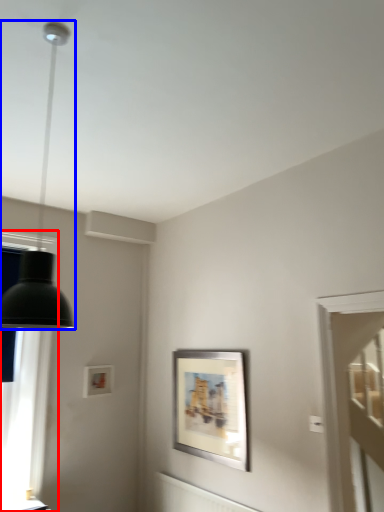
Question: Which object is further to the camera taking this photo, window (highlighted by a red box) or lamp (highlighted by a blue box)?

Choices:
 (A) window
 (B) lamp

Answer: (A)